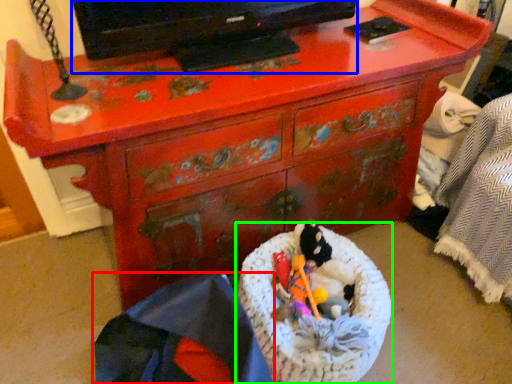
Question: Considering the real-world distances, which object is farthest from material (highlighted by a red box)? television (highlighted by a blue box) or laundry basket (highlighted by a green box)?

Choices:
 (A) television
 (B) laundry basket

Answer: (A)